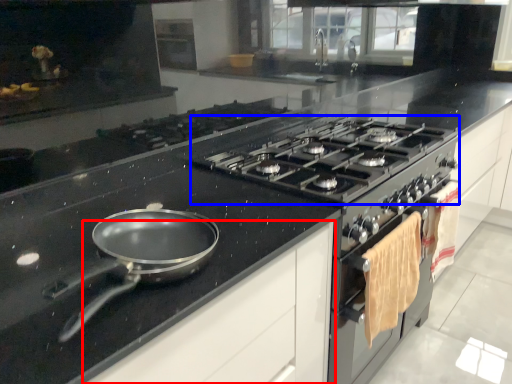
Question: Among these objects, which one is nearest to the camera, cabinetry (highlighted by a red box) or gas stove (highlighted by a blue box)?

Choices:
 (A) cabinetry
 (B) gas stove

Answer: (A)